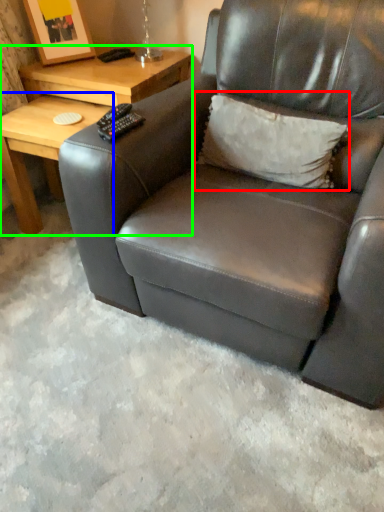
Question: Based on their relative distances, which object is farther from throw pillow (highlighted by a red box)? Choose from table (highlighted by a blue box) and table (highlighted by a green box).

Choices:
 (A) table
 (B) table

Answer: (A)